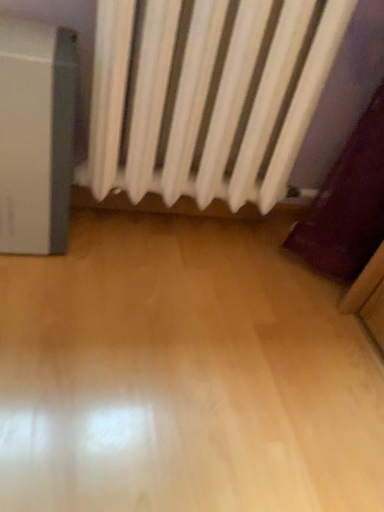
Question: Considering the positions of satin silver air purifier at left and white matte radiator at upper center in the image, is satin silver air purifier at left wider or thinner than white matte radiator at upper center?

Choices:
 (A) thin
 (B) wide

Answer: (B)

Question: Considering the positions of point (39, 98) and point (170, 84), is point (39, 98) closer or farther from the camera than point (170, 84)?

Choices:
 (A) closer
 (B) farther

Answer: (A)

Question: In the image, is satin silver air purifier at left on the left side or the right side of white matte radiator at upper center?

Choices:
 (A) right
 (B) left

Answer: (B)

Question: From a real-world perspective, is white matte radiator at upper center above or below satin silver air purifier at left?

Choices:
 (A) below
 (B) above

Answer: (B)

Question: Is white matte radiator at upper center inside the boundaries of satin silver air purifier at left, or outside?

Choices:
 (A) inside
 (B) outside

Answer: (B)

Question: Would you say white matte radiator at upper center is to the left or to the right of satin silver air purifier at left in the picture?

Choices:
 (A) left
 (B) right

Answer: (B)

Question: In terms of size, does white matte radiator at upper center appear bigger or smaller than satin silver air purifier at left?

Choices:
 (A) small
 (B) big

Answer: (B)